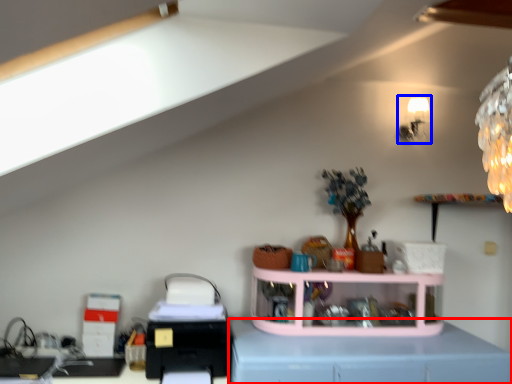
Question: Which object appears closest to the camera in this image, computer desk (highlighted by a red box) or lamp (highlighted by a blue box)?

Choices:
 (A) computer desk
 (B) lamp

Answer: (A)